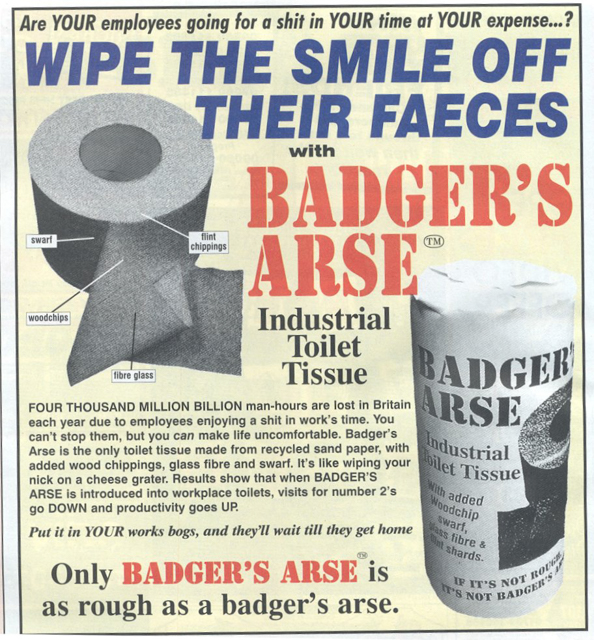
Find the location of a particular element. picture of badger's arse toilet tissue is located at coordinates (60, 175).